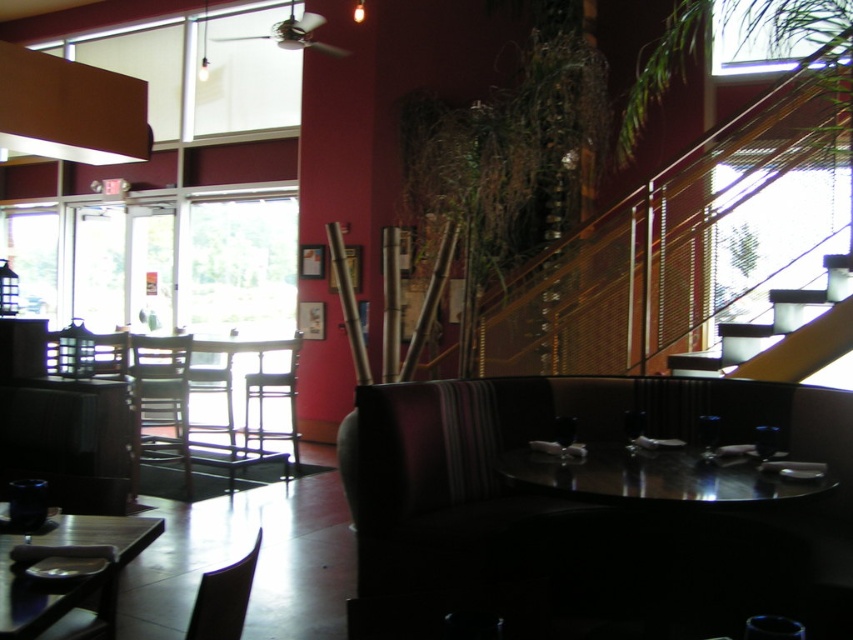
From the picture: You are a restaurant manager checking the layout. You need to seat a party of 8. Which table, the glossy black table at center or the wooden table at lower left, is more suitable for accommodating them?

The wooden table at lower left is more suitable for accommodating a party of 8 since it has a larger size compared to the glossy black table at center.

You are a server carrying a tray of dishes. You need to move from the glossy black table at center to the wooden table at lower left. What is the minimum distance you must travel between these two tables?

The glossy black table at center and wooden table at lower left are 1.19 meters apart from each other, so the minimum distance you must travel between them is 1.19 meters.